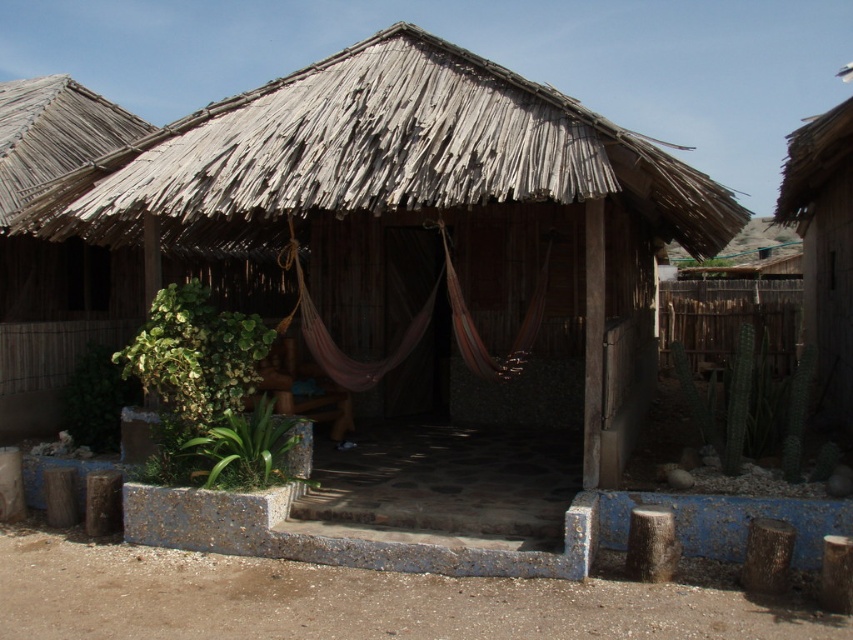
Does natural thatch roof at center have a smaller size compared to wooden hut at right?

Yes.

Does natural thatch roof at center appear under wooden hut at right?

Correct, natural thatch roof at center is located below wooden hut at right.

The height and width of the screenshot is (640, 853). In order to click on natural thatch roof at center in this screenshot , I will do `click(380, 154)`.

The width and height of the screenshot is (853, 640). Find the location of `natural thatch roof at center`. natural thatch roof at center is located at coordinates (380, 154).